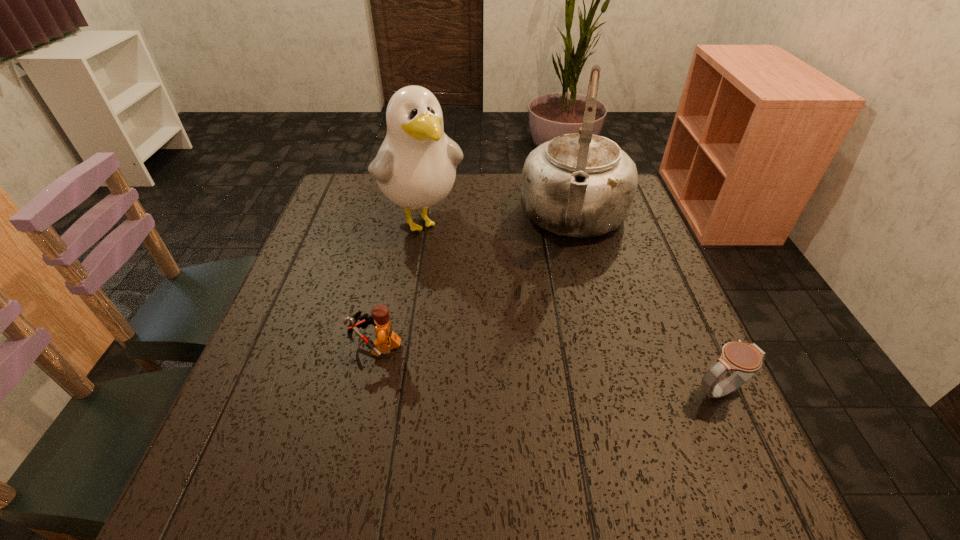
You are a GUI agent. You are given a task and a screenshot of the screen. Output one action in this format:
    pyautogui.click(x=<x>, y=<y>)
    Task: Click on the vacant spot on the desktop that is between the third farthest object and the watch and is positioned on the beak of the gull
    The image size is (960, 540).
    Given the screenshot: What is the action you would take?
    pyautogui.click(x=519, y=364)

Locate an element on the screen. This screenshot has height=540, width=960. free spot on the desktop that is between the Lego and the watch and is positioned at the spout of the kettle is located at coordinates (555, 369).